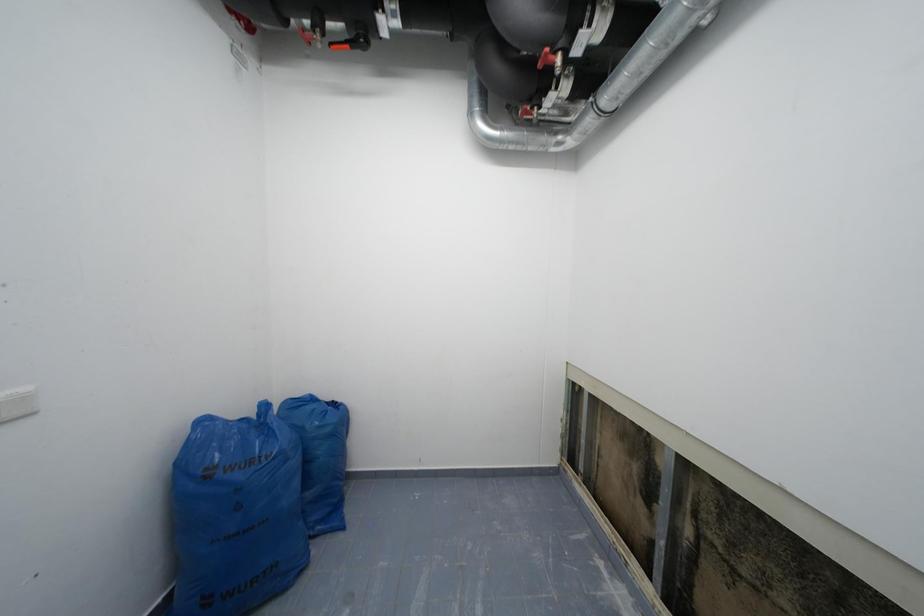
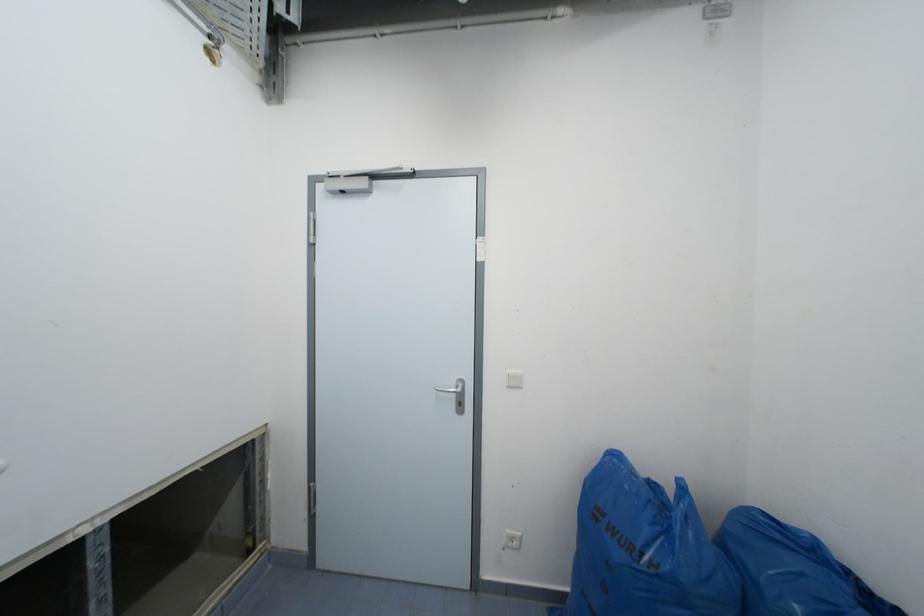
Question: The images are taken continuously from a first-person perspective. In which direction is your viewpoint rotating?

Choices:
 (A) Left
 (B) Right
 (C) Up
 (D) Down

Answer: (A)